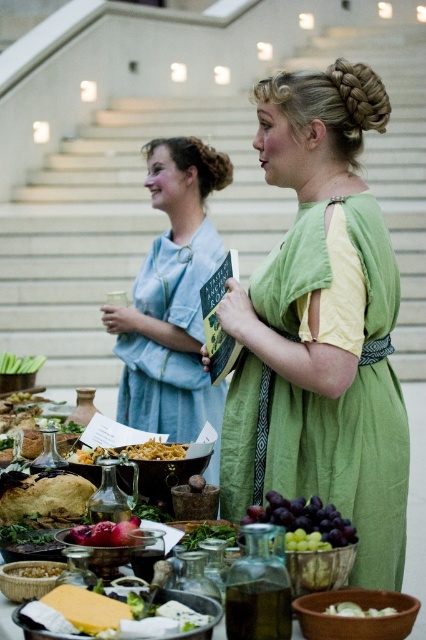
Question: Estimate the real-world distances between objects in this image. Which object is closer to the golden brown bread at lower left?

Choices:
 (A) light blue fabric dress at center
 (B) purple matte pomegranate at lower center
 (C) green leafy vegetables at center

Answer: (B)

Question: Among these objects, which one is nearest to the camera?

Choices:
 (A) green leafy vegetables at center
 (B) yellow cheese at lower left

Answer: (B)

Question: Is purple matte pomegranate at lower center above yellowish matte pasta at center?

Choices:
 (A) yes
 (B) no

Answer: (B)

Question: Which point appears farthest from the camera in this image?

Choices:
 (A) (94, 545)
 (B) (222, 502)
 (C) (17, 566)
 (D) (126, 616)

Answer: (B)

Question: Can you confirm if purple matte grapes at center is bigger than green leafy vegetables at center?

Choices:
 (A) yes
 (B) no

Answer: (A)

Question: Is green leafy vegetables at center positioned before yellowish matte pasta at center?

Choices:
 (A) no
 (B) yes

Answer: (B)